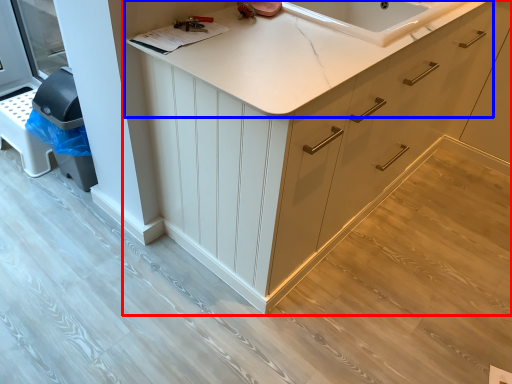
Question: Which object is further to the camera taking this photo, cabinetry (highlighted by a red box) or countertop (highlighted by a blue box)?

Choices:
 (A) cabinetry
 (B) countertop

Answer: (B)